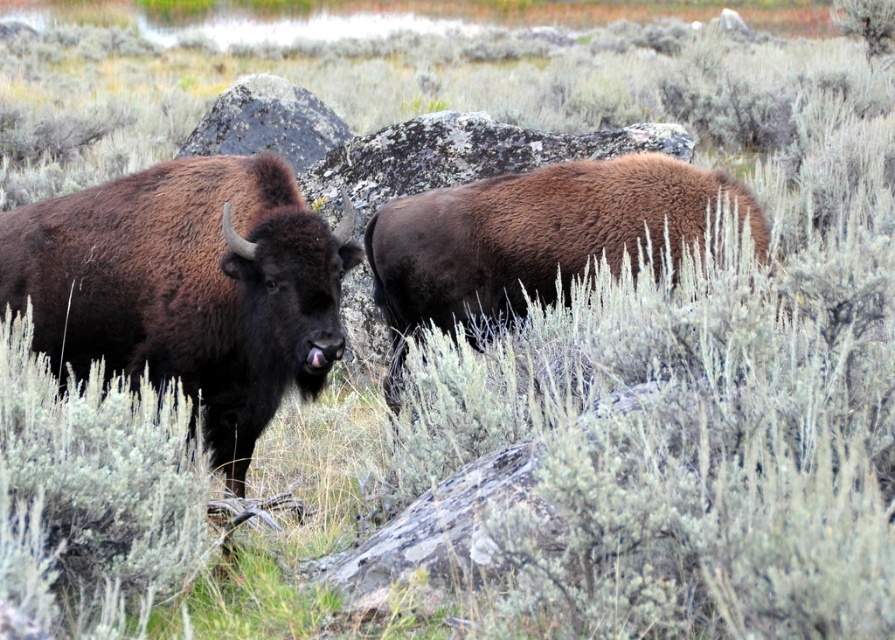
Is brown fuzzy buffalo at left smaller than gray rock at center?

Yes, brown fuzzy buffalo at left is smaller than gray rock at center.

You are a GUI agent. You are given a task and a screenshot of the screen. Output one action in this format:
    pyautogui.click(x=<x>, y=<y>)
    Task: Click on the brown fuzzy buffalo at left
    Image resolution: width=895 pixels, height=640 pixels.
    Given the screenshot: What is the action you would take?
    pyautogui.click(x=186, y=288)

Is brown fuzzy bison at center bigger than gray rock at center?

No, brown fuzzy bison at center is not bigger than gray rock at center.

Can you confirm if brown fuzzy bison at center is wider than gray rock at center?

Yes, brown fuzzy bison at center is wider than gray rock at center.

Does point (431, 260) come closer to viewer compared to point (209, 116)?

Yes, point (431, 260) is closer to viewer.

What are the coordinates of `brown fuzzy bison at center` in the screenshot? It's located at (533, 240).

In the scene shown: How far apart are brown fuzzy buffalo at left and brown fuzzy bison at center?

The distance of brown fuzzy buffalo at left from brown fuzzy bison at center is 1.11 meters.

Is brown fuzzy buffalo at left shorter than brown fuzzy bison at center?

No.

At what (x,y) coordinates should I click in order to perform the action: click on brown fuzzy buffalo at left. Please return your answer as a coordinate pair (x, y). This screenshot has height=640, width=895. Looking at the image, I should click on (186, 288).

Where is `brown fuzzy buffalo at left`? Image resolution: width=895 pixels, height=640 pixels. brown fuzzy buffalo at left is located at coordinates (186, 288).